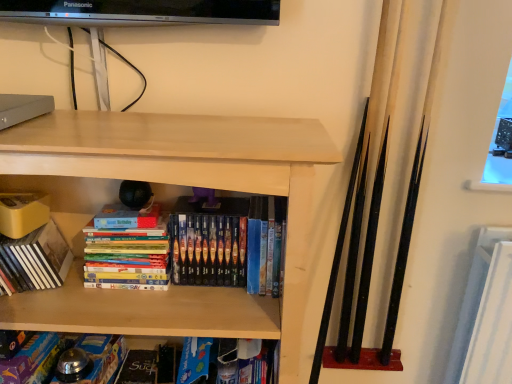
Question: Which direction should I rotate to look at blue cardboard book at lower center, the third book positioned from the right?

Choices:
 (A) left
 (B) right

Answer: (A)

Question: Can you confirm if matte black paperback book at lower center is positioned to the right of light wood shelf at center?

Choices:
 (A) yes
 (B) no

Answer: (A)

Question: Does matte black paperback book at lower center contain light wood shelf at center?

Choices:
 (A) no
 (B) yes

Answer: (A)

Question: Does matte black paperback book at lower center come in front of light wood shelf at center?

Choices:
 (A) yes
 (B) no

Answer: (B)

Question: Is light wood shelf at center at the back of matte black paperback book at lower center?

Choices:
 (A) yes
 (B) no

Answer: (A)

Question: Is matte black paperback book at lower center placed right next to light wood shelf at center?

Choices:
 (A) yes
 (B) no

Answer: (B)

Question: Is matte black paperback book at lower center wider than light wood shelf at center?

Choices:
 (A) no
 (B) yes

Answer: (A)

Question: From a real-world perspective, does light wood shelf at center sit lower than blue cardboard book at lower center, arranged as the 2th book when viewed from the left?

Choices:
 (A) no
 (B) yes

Answer: (A)

Question: From the image's perspective, is light wood shelf at center beneath blue cardboard book at lower center, arranged as the 2th book when viewed from the left?

Choices:
 (A) yes
 (B) no

Answer: (B)

Question: Considering the relative positions of light wood shelf at center and blue cardboard book at lower center, the third book positioned from the right, in the image provided, is light wood shelf at center to the left of blue cardboard book at lower center, the third book positioned from the right, from the viewer's perspective?

Choices:
 (A) no
 (B) yes

Answer: (A)

Question: Is light wood shelf at center positioned with its back to blue cardboard book at lower center, arranged as the 2th book when viewed from the left?

Choices:
 (A) yes
 (B) no

Answer: (A)

Question: Is light wood shelf at center located outside blue cardboard book at lower center, the third book positioned from the right?

Choices:
 (A) no
 (B) yes

Answer: (B)

Question: Are light wood shelf at center and blue cardboard book at lower center, the third book positioned from the right, beside each other?

Choices:
 (A) no
 (B) yes

Answer: (A)

Question: Can you confirm if hardcover books at center, which appears as the 1th book when viewed from the right, is positioned to the left of matte yellow book at left, which is counted as the fourth book, starting from the right?

Choices:
 (A) yes
 (B) no

Answer: (B)